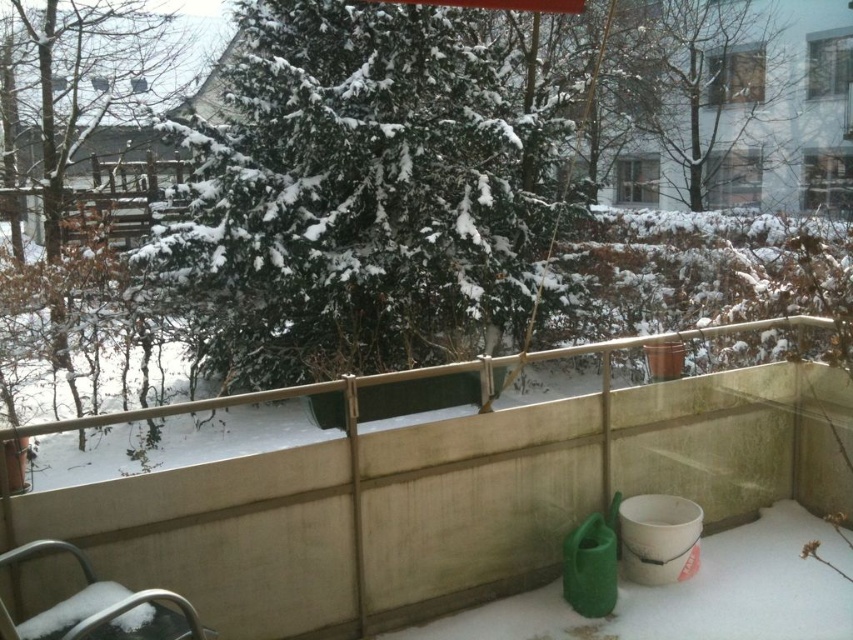
Can you confirm if snow-covered evergreen tree at upper center is taller than green textured tree at upper center?

Indeed, snow-covered evergreen tree at upper center has a greater height compared to green textured tree at upper center.

Identify the location of snow-covered evergreen tree at upper center. point(349,195).

Which is above, green textured tree at upper center or metallic silver chair at lower left?

green textured tree at upper center is higher up.

Between point (659, 116) and point (28, 554), which one is positioned in front?

Point (28, 554)

At what (x,y) coordinates should I click in order to perform the action: click on green textured tree at upper center. Please return your answer as a coordinate pair (x, y). The width and height of the screenshot is (853, 640). Looking at the image, I should click on (718, 104).

What are the coordinates of `snow-covered evergreen tree at upper center` in the screenshot? It's located at pyautogui.click(x=349, y=195).

Does snow-covered evergreen tree at upper center have a lesser height compared to metallic silver chair at lower left?

In fact, snow-covered evergreen tree at upper center may be taller than metallic silver chair at lower left.

This screenshot has height=640, width=853. Describe the element at coordinates (349, 195) in the screenshot. I see `snow-covered evergreen tree at upper center` at that location.

This screenshot has height=640, width=853. In order to click on snow-covered evergreen tree at upper center in this screenshot , I will do (x=349, y=195).